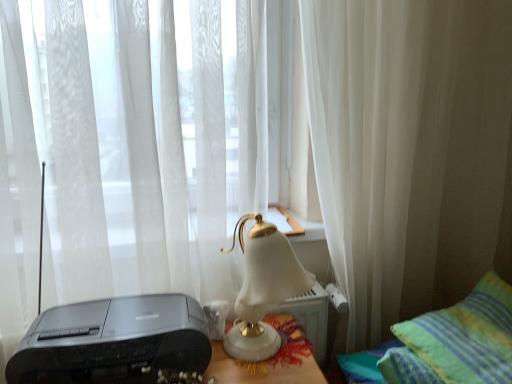
Question: Does white sheer curtain at center, placed as the 1th curtain when sorted from right to left, turn towards white porcelain lamp at center?

Choices:
 (A) no
 (B) yes

Answer: (A)

Question: Considering the relative positions of white sheer curtain at center, the second curtain when ordered from left to right, and white porcelain lamp at center in the image provided, is white sheer curtain at center, the second curtain when ordered from left to right, to the right of white porcelain lamp at center from the viewer's perspective?

Choices:
 (A) yes
 (B) no

Answer: (A)

Question: Is white sheer curtain at center, placed as the 1th curtain when sorted from right to left, taller than white porcelain lamp at center?

Choices:
 (A) no
 (B) yes

Answer: (B)

Question: Can you confirm if white sheer curtain at center, placed as the 1th curtain when sorted from right to left, is wider than white porcelain lamp at center?

Choices:
 (A) yes
 (B) no

Answer: (B)

Question: Does white sheer curtain at center, the second curtain when ordered from left to right, touch white porcelain lamp at center?

Choices:
 (A) yes
 (B) no

Answer: (B)

Question: From the image's perspective, is matte black printer at lower left above or below green striped pillow at lower right?

Choices:
 (A) above
 (B) below

Answer: (A)

Question: Based on their sizes in the image, would you say matte black printer at lower left is bigger or smaller than green striped pillow at lower right?

Choices:
 (A) big
 (B) small

Answer: (B)

Question: Considering the relative positions of matte black printer at lower left and green striped pillow at lower right in the image provided, is matte black printer at lower left to the left or to the right of green striped pillow at lower right?

Choices:
 (A) right
 (B) left

Answer: (B)

Question: In the image, is matte black printer at lower left positioned in front of or behind green striped pillow at lower right?

Choices:
 (A) front
 (B) behind

Answer: (B)

Question: From a real-world perspective, is white porcelain lamp at center physically located above or below white sheer curtain at center, placed as the 1th curtain when sorted from right to left?

Choices:
 (A) below
 (B) above

Answer: (A)

Question: Is white porcelain lamp at center taller or shorter than white sheer curtain at center, placed as the 1th curtain when sorted from right to left?

Choices:
 (A) short
 (B) tall

Answer: (A)

Question: Does point (305, 286) appear closer or farther from the camera than point (392, 241)?

Choices:
 (A) closer
 (B) farther

Answer: (A)

Question: In the image, is white porcelain lamp at center positioned in front of or behind white sheer curtain at center, the second curtain when ordered from left to right?

Choices:
 (A) behind
 (B) front

Answer: (B)

Question: Based on their sizes in the image, would you say white sheer curtain at center, positioned as the 2th curtain in right-to-left order, is bigger or smaller than white porcelain lamp at center?

Choices:
 (A) big
 (B) small

Answer: (A)

Question: Is point (68, 266) positioned closer to the camera than point (245, 286)?

Choices:
 (A) closer
 (B) farther

Answer: (B)